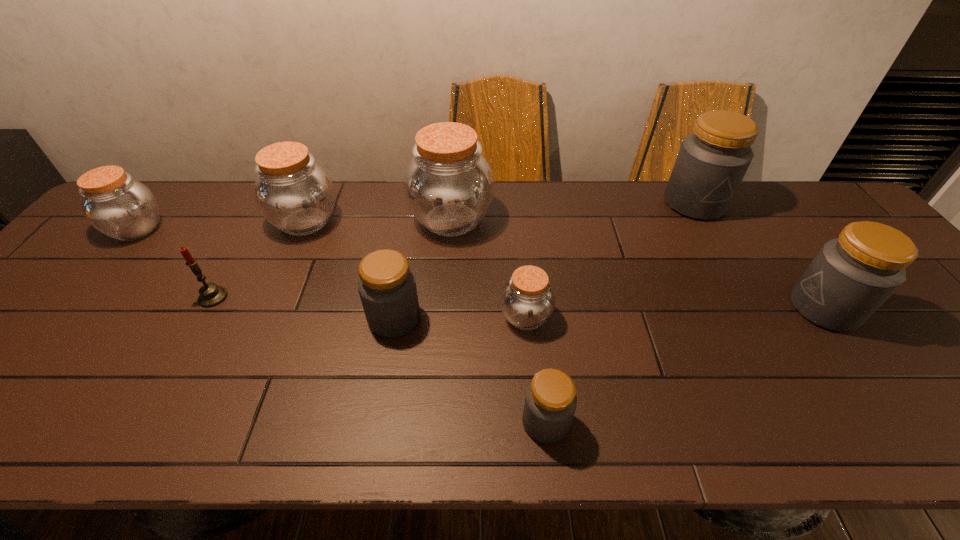
Find the location of a particular element. This screenshot has height=540, width=960. vacant region located on the right of the third biggest brown jar is located at coordinates (276, 230).

Identify the location of vacant space located 0.260m on the surface of the leftmost gray jar near the warning symbol. (530, 318).

The image size is (960, 540). I want to click on free location located 0.130m on the front of the red candle, so click(182, 352).

What are the coordinates of `vacant space situated 0.170m on the left of the nearest brown jar` in the screenshot? It's located at (428, 317).

At what (x,y) coordinates should I click in order to perform the action: click on free region located on the surface of the nearest jar near the warning symbol. Please return your answer as a coordinate pair (x, y). The width and height of the screenshot is (960, 540). Looking at the image, I should click on (425, 422).

Identify the location of vacant space located on the surface of the nearest jar near the warning symbol. (324, 422).

Find the location of a particular element. The height and width of the screenshot is (540, 960). vacant space located on the surface of the nearest jar near the warning symbol is located at coordinates (487, 422).

The width and height of the screenshot is (960, 540). I want to click on object located in the near edge section of the desktop, so click(550, 402).

This screenshot has width=960, height=540. What are the coordinates of `object that is at the left edge` in the screenshot? It's located at (116, 205).

Identify the location of object at the far left corner. (116, 205).